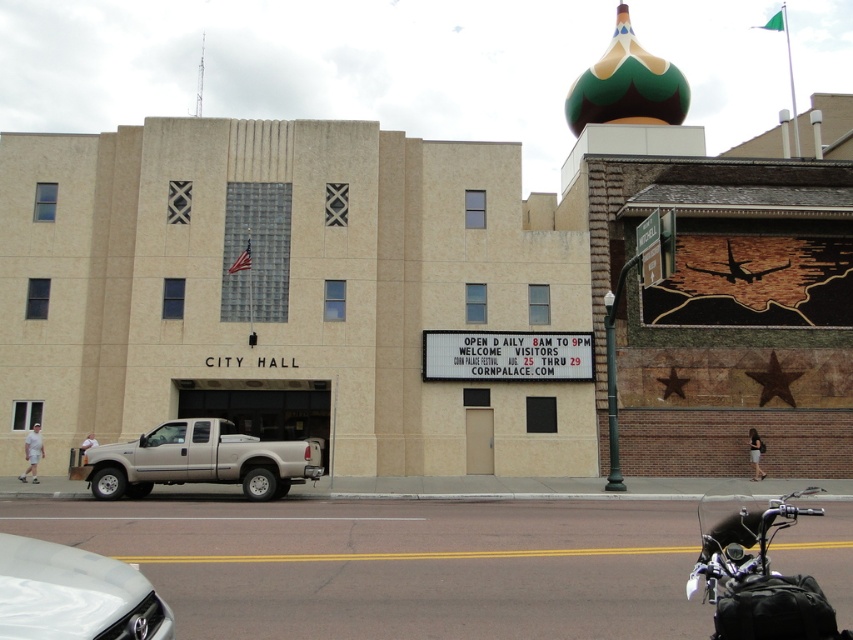
Question: Does black textured motorcycle at lower right appear on the right side of silver metallic truck at center-left?

Choices:
 (A) no
 (B) yes

Answer: (B)

Question: Is white glossy car at lower left closer to the viewer compared to silver metallic truck at center-left?

Choices:
 (A) no
 (B) yes

Answer: (B)

Question: Estimate the real-world distances between objects in this image. Which object is closer to the silver metallic truck at center-left?

Choices:
 (A) white glossy car at lower left
 (B) black textured motorcycle at lower right

Answer: (B)

Question: Does black textured motorcycle at lower right have a greater width compared to white glossy car at lower left?

Choices:
 (A) yes
 (B) no

Answer: (A)

Question: Which object appears farthest from the camera in this image?

Choices:
 (A) white glossy car at lower left
 (B) black textured motorcycle at lower right
 (C) silver metallic truck at center-left

Answer: (C)

Question: Which point is closer to the camera?

Choices:
 (A) silver metallic truck at center-left
 (B) white glossy car at lower left
 (C) black textured motorcycle at lower right

Answer: (B)